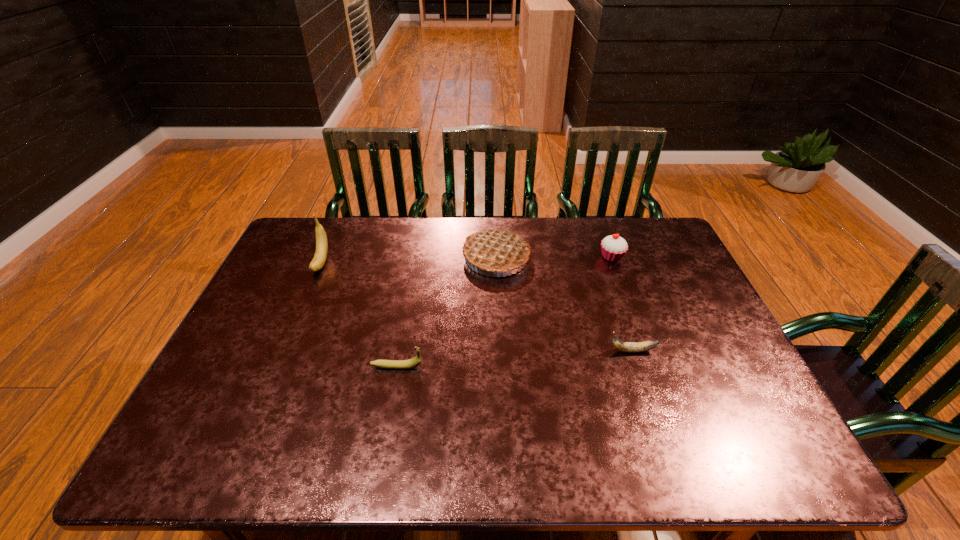
In the image, there is a desktop. Where is `free space at the far edge`? The height and width of the screenshot is (540, 960). free space at the far edge is located at coordinates (472, 233).

Where is `vacant space at the near edge of the desktop`? vacant space at the near edge of the desktop is located at coordinates (383, 444).

At what (x,y) coordinates should I click in order to perform the action: click on vacant space at the left edge. Please return your answer as a coordinate pair (x, y). The height and width of the screenshot is (540, 960). Looking at the image, I should click on (300, 318).

Find the location of `vacant space at the right edge of the desktop`. vacant space at the right edge of the desktop is located at coordinates (696, 381).

This screenshot has width=960, height=540. I want to click on free space at the near left corner, so click(204, 450).

Identify the location of free point at the near right corner. (750, 451).

At what (x,y) coordinates should I click in order to perform the action: click on vacant region between the second farthest banana and the leftmost object. Please return your answer as a coordinate pair (x, y). The image size is (960, 540). Looking at the image, I should click on (477, 307).

Identify the location of vacant area between the shortest banana and the cupcake. (622, 304).

Identify the location of vacant space in between the third object from right to left and the leftmost banana. The width and height of the screenshot is (960, 540). [409, 260].

Locate an element on the screen. This screenshot has height=540, width=960. free space that is in between the third object from left to right and the second object from left to right is located at coordinates (446, 312).